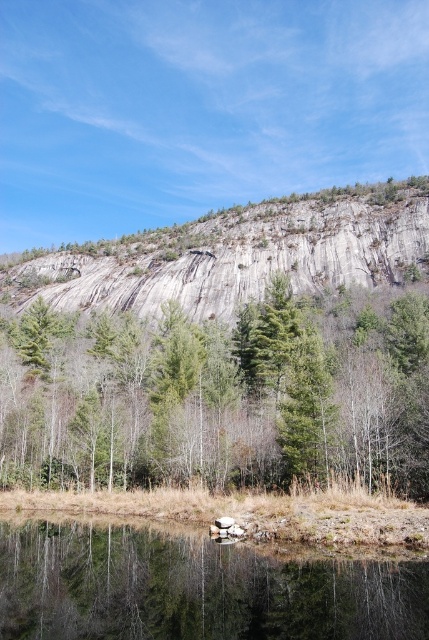
Question: Among these points, which one is nearest to the camera?

Choices:
 (A) (256, 588)
 (B) (337, 250)
 (C) (410, 486)

Answer: (A)

Question: Which point appears closest to the camera in this image?

Choices:
 (A) (108, 259)
 (B) (213, 337)
 (C) (32, 545)

Answer: (C)

Question: Can you confirm if clear water at bottom is smaller than gray rock cliff at upper center?

Choices:
 (A) no
 (B) yes

Answer: (B)

Question: Is green textured tree at center thinner than gray rock cliff at upper center?

Choices:
 (A) yes
 (B) no

Answer: (A)

Question: Which point is closer to the camera?

Choices:
 (A) gray rock cliff at upper center
 (B) green textured tree at center

Answer: (B)

Question: Is green textured tree at center smaller than clear water at bottom?

Choices:
 (A) no
 (B) yes

Answer: (A)